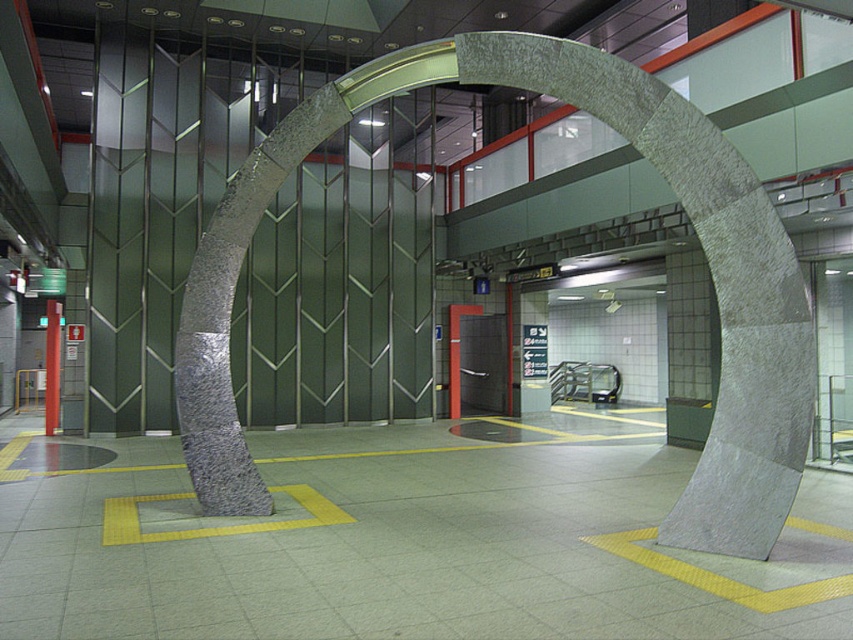
Is gray stone arch at center further to camera compared to metallic pole at left?

No.

Between gray stone arch at center and metallic pole at left, which one appears on the right side from the viewer's perspective?

gray stone arch at center

Find the location of a particular element. The height and width of the screenshot is (640, 853). gray stone arch at center is located at coordinates (679, 202).